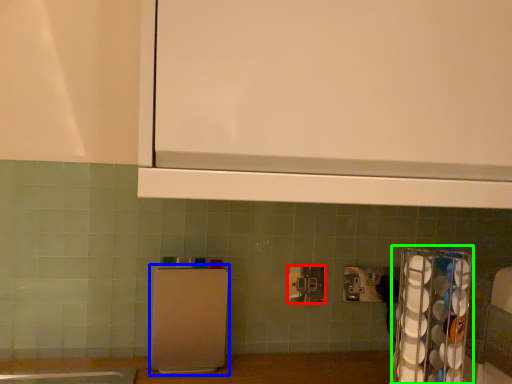
Question: Based on their relative distances, which object is nearer to power plugs and sockets (highlighted by a red box)? Choose from appliance (highlighted by a blue box) and appliance (highlighted by a green box).

Choices:
 (A) appliance
 (B) appliance

Answer: (A)